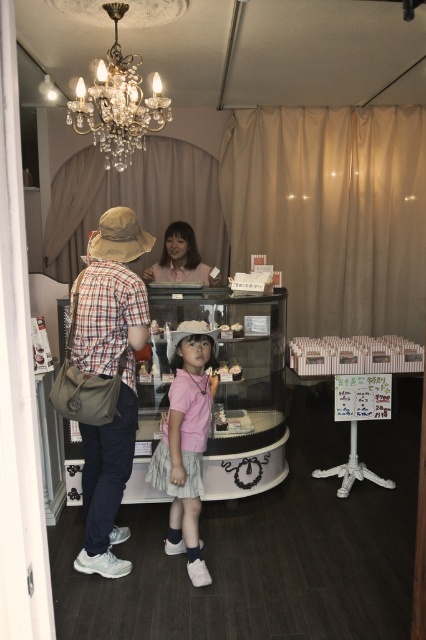
Question: Does matte plaid shirt at center appear over pink cotton shirt at center?

Choices:
 (A) no
 (B) yes

Answer: (B)

Question: Can you confirm if pink cotton shirt at center is positioned above crystal chandelier at upper center?

Choices:
 (A) no
 (B) yes

Answer: (A)

Question: Observing the image, what is the correct spatial positioning of matte plaid shirt at center in reference to crystal chandelier at upper center?

Choices:
 (A) below
 (B) above

Answer: (A)

Question: Which object appears farthest from the camera in this image?

Choices:
 (A) matte plaid shirt at center
 (B) pink cotton shirt at center

Answer: (B)

Question: Which of the following is the farthest from the observer?

Choices:
 (A) pink fabric shirt at center
 (B) pink cotton shirt at center

Answer: (A)

Question: Which of the following is the farthest from the observer?

Choices:
 (A) pink fabric shirt at center
 (B) matte plaid shirt at center
 (C) pink cotton shirt at center

Answer: (A)